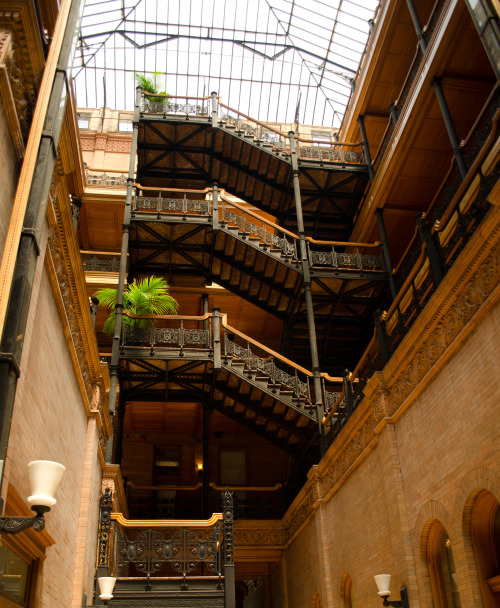
Where is `stairs`? The image size is (500, 608). stairs is located at coordinates (276, 247), (239, 350).